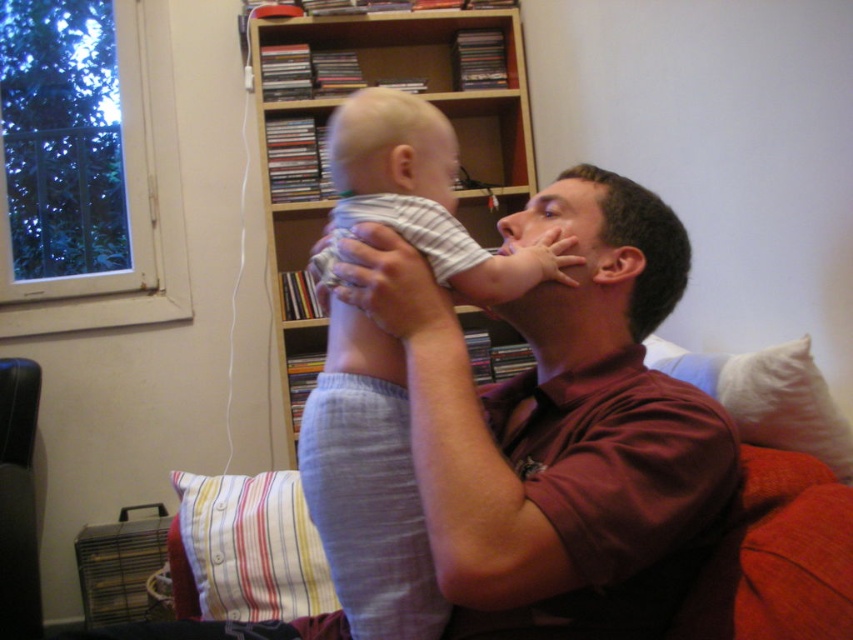
Question: Can you confirm if striped cotton shirt at center is positioned below striped fabric pillow at lower left?

Choices:
 (A) no
 (B) yes

Answer: (A)

Question: Can you confirm if striped cotton shirt at center is positioned to the left of striped fabric pillow at lower left?

Choices:
 (A) no
 (B) yes

Answer: (A)

Question: Which object appears closest to the camera in this image?

Choices:
 (A) white soft pillow at right
 (B) striped cotton shirt at center
 (C) wooden bookshelf at upper center
 (D) gray striped shirt at center

Answer: (D)

Question: Can you confirm if wooden bookshelf at upper center is wider than white soft pillow at right?

Choices:
 (A) no
 (B) yes

Answer: (B)

Question: Which object is the farthest from the white soft pillow at right?

Choices:
 (A) gray striped shirt at center
 (B) wooden bookshelf at upper center

Answer: (B)

Question: Which object appears farthest from the camera in this image?

Choices:
 (A) gray striped shirt at center
 (B) wooden bookshelf at upper center

Answer: (B)